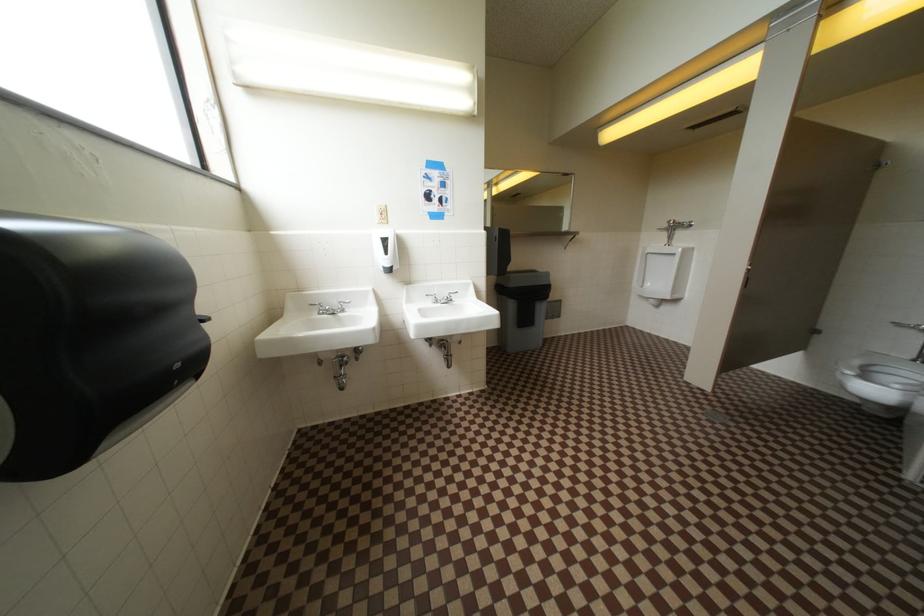
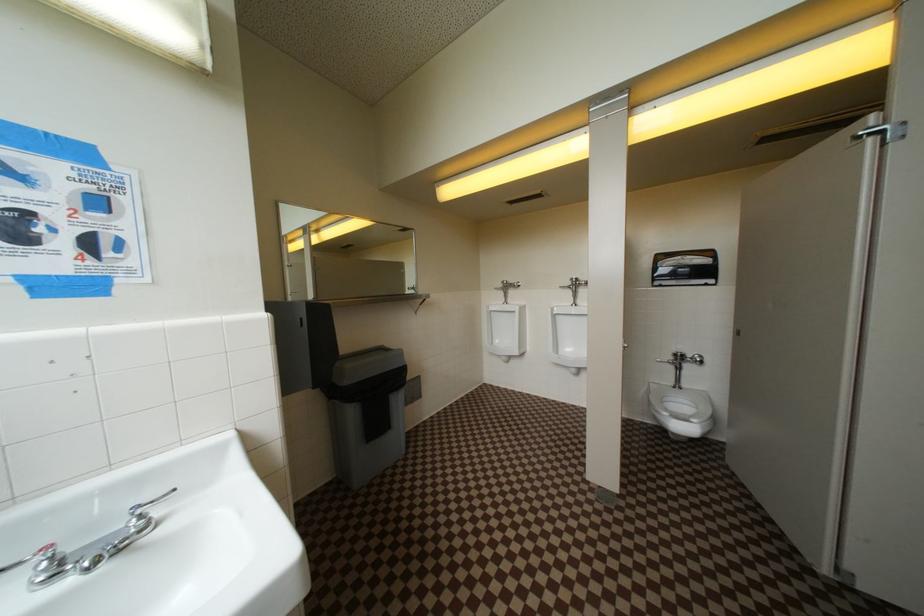
Question: Based on the continuous images, in which direction is the camera rotating? Reply with the corresponding letter.

Choices:
 (A) Left
 (B) Right
 (C) Up
 (D) Down

Answer: (B)